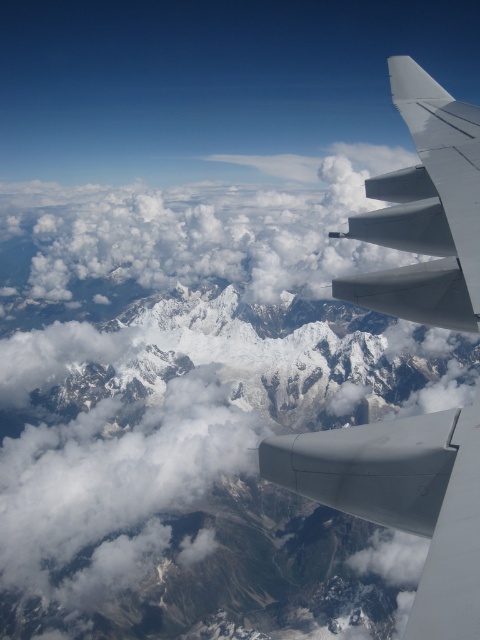
Based on the scene described, where is the snowy rocky mountain range at center located in the image?

The snowy rocky mountain range at center is located at point coordinates of (225, 474).

You are a passenger seated at the window seat of the airplane. Looking out, you see the snowy rocky mountain range at center and the matte gray wing at right. Which object appears taller in the view from your seat?

The snowy rocky mountain range at center appears much taller than the matte gray wing at right in the view from the airplane window seat.

Based on the photo, you are a passenger sitting by the window and want to take a photo of the mountain range. You notice two points marked on your window at coordinates point (64, 228) and point (283, 438). Which point is closer to your eye level when looking out the window?

Point (64, 228) is closer to your eye level because it is further to the camera than point (283, 438), meaning it appears nearer in the window view.